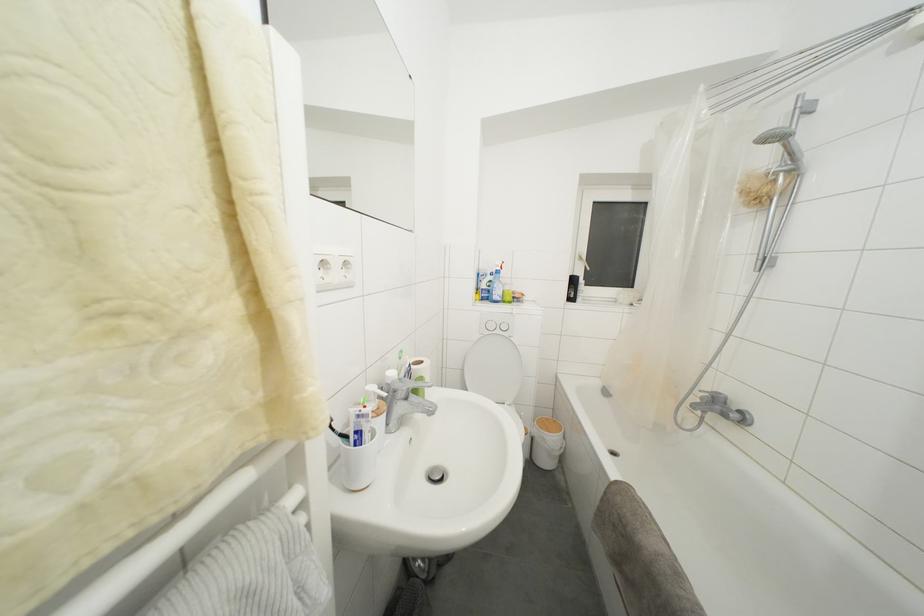
Where would you press the toilet flush buttons? Please return your answer as a coordinate pair (x, y).

(505, 358)